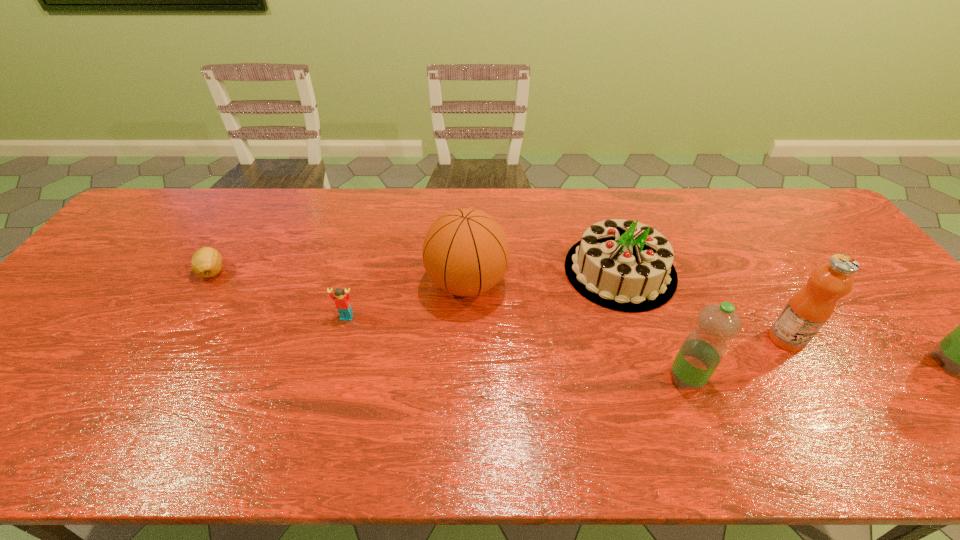
You are a GUI agent. You are given a task and a screenshot of the screen. Output one action in this format:
    pyautogui.click(x=<x>, y=<y>)
    Task: Click on the shorter water bottle
    This screenshot has width=960, height=540.
    Given the screenshot: What is the action you would take?
    pyautogui.click(x=703, y=349)

The image size is (960, 540). In order to click on the leftmost object in this screenshot , I will do `click(206, 262)`.

Find the location of a particular element. The image size is (960, 540). lemon is located at coordinates (206, 262).

What are the coordinates of `the third object from left to right` in the screenshot? It's located at (465, 252).

Identify the location of birthday cake. The image size is (960, 540). (623, 265).

Image resolution: width=960 pixels, height=540 pixels. I want to click on the second object from right to left, so click(808, 310).

Identify the location of the sixth object from right to left. (342, 302).

Find the location of a particular element. Lego is located at coordinates (342, 302).

Where is `vacant region located on the right of the shorter water bottle`? The width and height of the screenshot is (960, 540). vacant region located on the right of the shorter water bottle is located at coordinates (791, 379).

Locate an element on the screen. This screenshot has width=960, height=540. free space located 0.050m at the stem end of the shortest object is located at coordinates (197, 298).